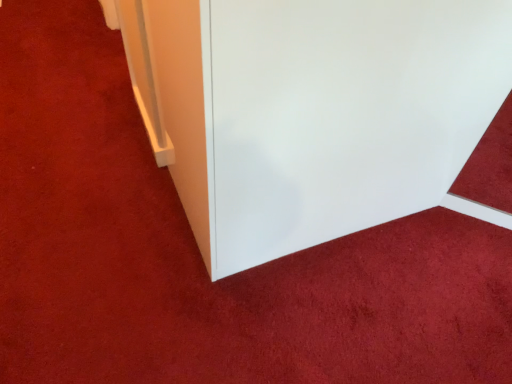
Where is `white glossy cabinet at center`? white glossy cabinet at center is located at coordinates (310, 111).

What do you see at coordinates (310, 111) in the screenshot?
I see `white glossy cabinet at center` at bounding box center [310, 111].

Where is `white glossy cabinet at center`? Image resolution: width=512 pixels, height=384 pixels. white glossy cabinet at center is located at coordinates (310, 111).